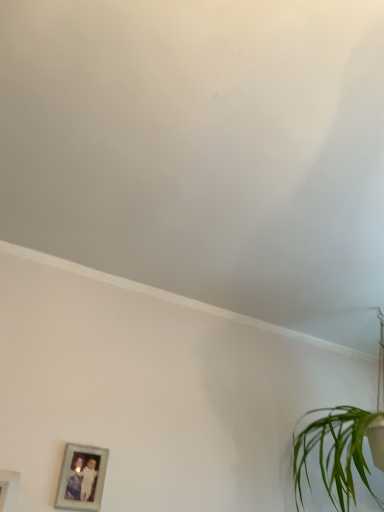
Question: Does silver metallic photo frame at lower left, the first picture frame in the back-to-front sequence, have a greater height compared to green leafy plant at lower right?

Choices:
 (A) yes
 (B) no

Answer: (B)

Question: Considering the relative positions of silver metallic photo frame at lower left, the 2th picture frame in the left-to-right sequence, and green leafy plant at lower right in the image provided, is silver metallic photo frame at lower left, the 2th picture frame in the left-to-right sequence, to the left of green leafy plant at lower right from the viewer's perspective?

Choices:
 (A) no
 (B) yes

Answer: (B)

Question: Considering the relative sizes of silver metallic photo frame at lower left, the first picture frame in the back-to-front sequence, and green leafy plant at lower right in the image provided, is silver metallic photo frame at lower left, the first picture frame in the back-to-front sequence, thinner than green leafy plant at lower right?

Choices:
 (A) no
 (B) yes

Answer: (B)

Question: Can you confirm if silver metallic photo frame at lower left, arranged as the 1th picture frame when viewed from the right, is shorter than green leafy plant at lower right?

Choices:
 (A) yes
 (B) no

Answer: (A)

Question: Is silver metallic photo frame at lower left, the 2th picture frame in the left-to-right sequence, looking in the opposite direction of green leafy plant at lower right?

Choices:
 (A) yes
 (B) no

Answer: (B)

Question: Is silver metallic photo frame at lower left, the second picture frame from the front, positioned far away from green leafy plant at lower right?

Choices:
 (A) yes
 (B) no

Answer: (B)

Question: Is the position of silver metallic photo frame at lower left, the 2th picture frame in the left-to-right sequence, less distant than that of white matte picture frame at lower left, which is counted as the 2th picture frame, starting from the right?

Choices:
 (A) no
 (B) yes

Answer: (A)

Question: From a real-world perspective, is silver metallic photo frame at lower left, the second picture frame from the front, on white matte picture frame at lower left, which is the first picture frame from front to back?

Choices:
 (A) no
 (B) yes

Answer: (B)

Question: Is silver metallic photo frame at lower left, the second picture frame from the front, at the left side of white matte picture frame at lower left, which is counted as the 2th picture frame, starting from the right?

Choices:
 (A) no
 (B) yes

Answer: (A)

Question: Considering the relative sizes of silver metallic photo frame at lower left, the 2th picture frame in the left-to-right sequence, and white matte picture frame at lower left, the 1th picture frame from the left, in the image provided, is silver metallic photo frame at lower left, the 2th picture frame in the left-to-right sequence, thinner than white matte picture frame at lower left, the 1th picture frame from the left,?

Choices:
 (A) yes
 (B) no

Answer: (B)

Question: Is white matte picture frame at lower left, the 2th picture frame viewed from the back, at the back of silver metallic photo frame at lower left, arranged as the 1th picture frame when viewed from the right?

Choices:
 (A) yes
 (B) no

Answer: (B)

Question: From a real-world perspective, is silver metallic photo frame at lower left, the second picture frame from the front, beneath white matte picture frame at lower left, the 2th picture frame viewed from the back?

Choices:
 (A) yes
 (B) no

Answer: (B)

Question: Is white matte wall at upper center beside white matte picture frame at lower left, the 2th picture frame viewed from the back?

Choices:
 (A) no
 (B) yes

Answer: (A)